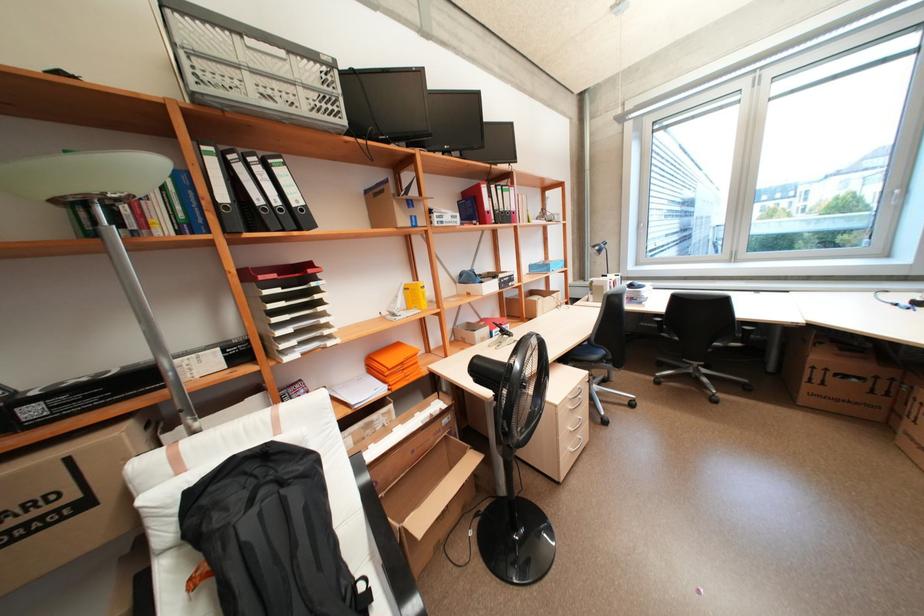
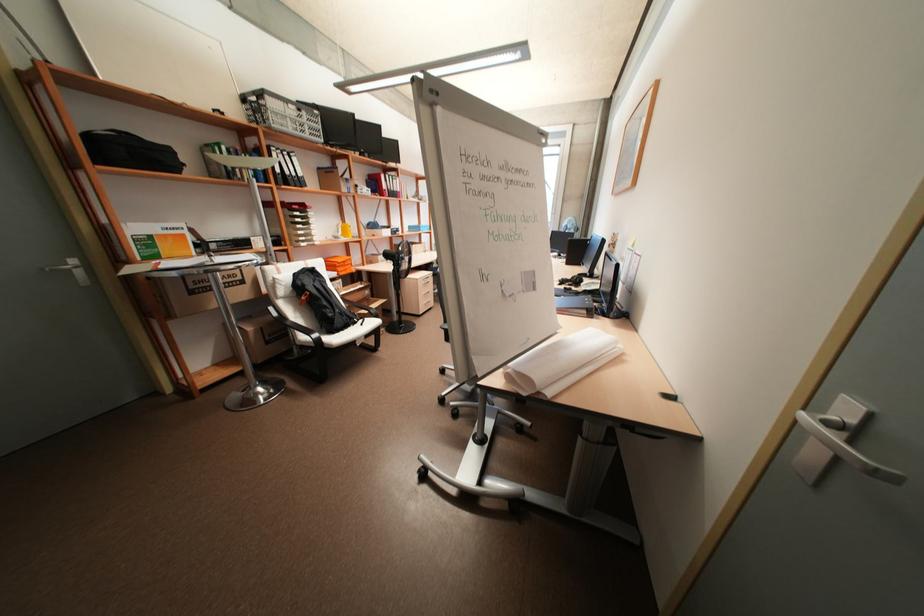
Question: In a continuous first-person perspective shot, in which direction is the camera moving?

Choices:
 (A) Left
 (B) Right
 (C) Forward
 (D) Backward

Answer: (D)